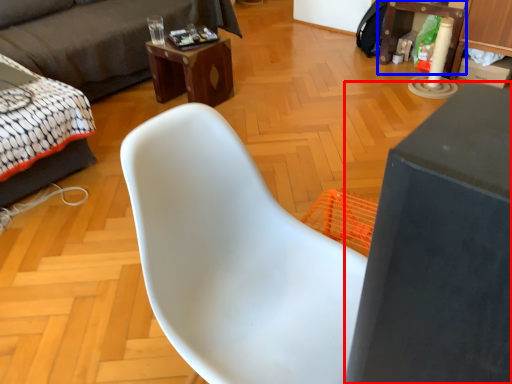
Question: Which of the following is the closest to the observer, table (highlighted by a red box) or table (highlighted by a blue box)?

Choices:
 (A) table
 (B) table

Answer: (A)